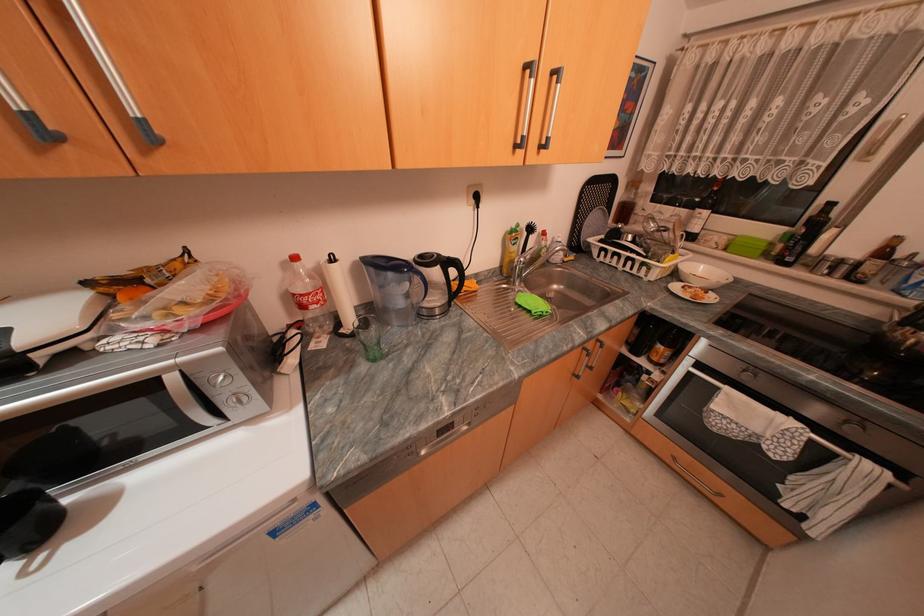
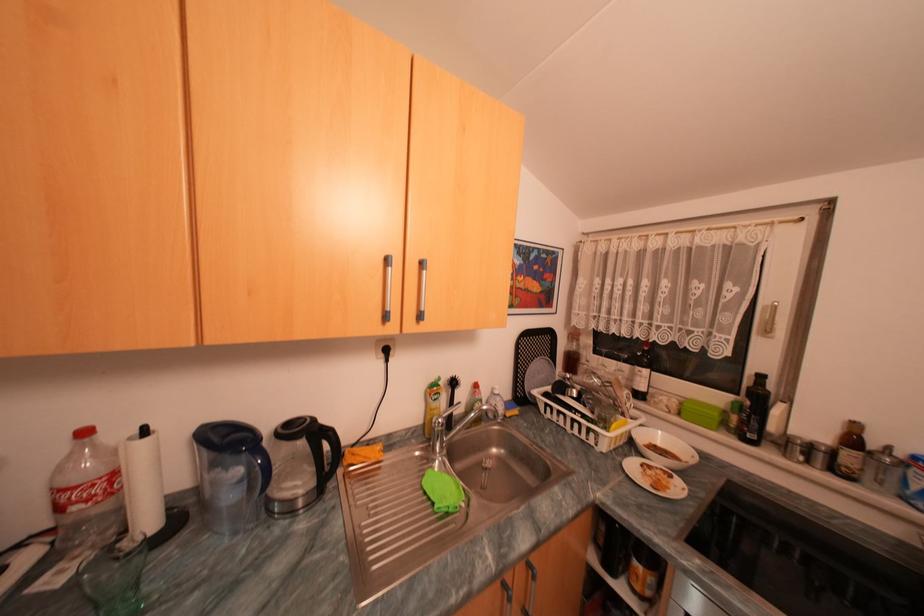
Question: The first image is from the beginning of the video and the second image is from the end. How did the camera likely rotate when shooting the video?

Choices:
 (A) Left
 (B) Right
 (C) Up
 (D) Down

Answer: (C)